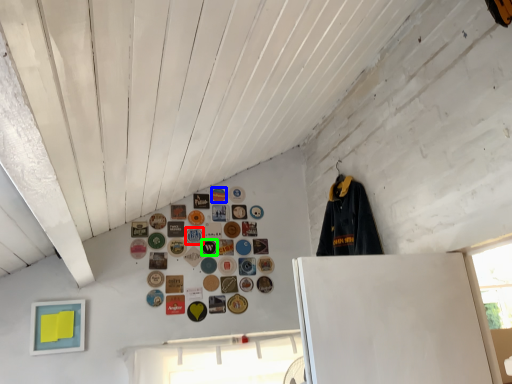
Question: Estimate the real-world distances between objects in this image. Which object is closer to button (highlighted by a red box), button (highlighted by a blue box) or button (highlighted by a green box)?

Choices:
 (A) button
 (B) button

Answer: (B)